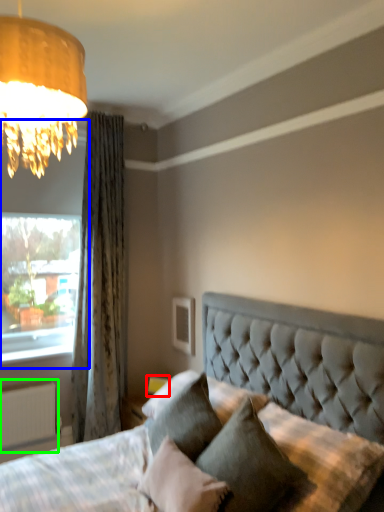
Question: Which is nearer to the table lamp (highlighted by a red box)? window (highlighted by a blue box) or radiator (highlighted by a green box).

Choices:
 (A) window
 (B) radiator

Answer: (B)